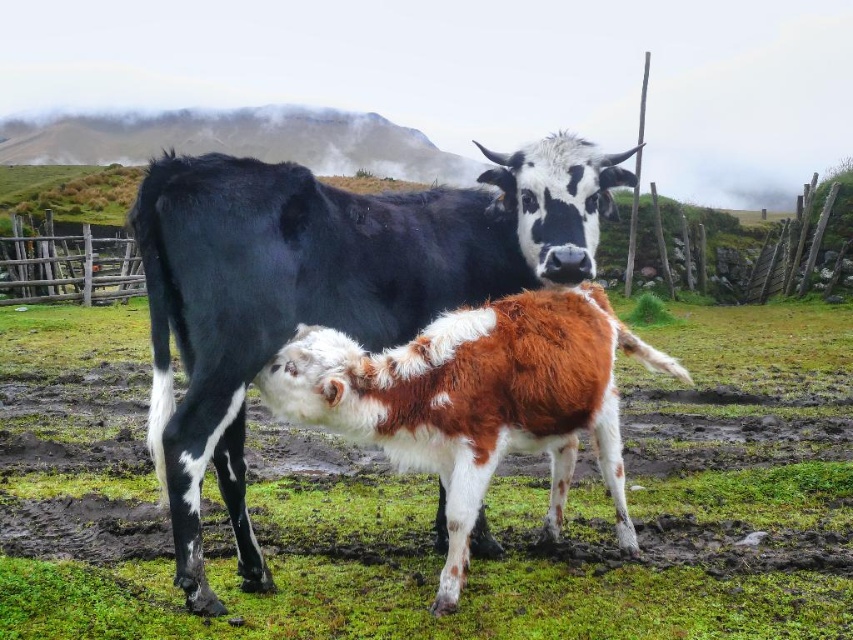
You are a farmer checking the field. You notice the black and white cow at center and the wooden fence at left. Which object is narrower in width?

The black and white cow at center is thinner than the wooden fence at left, so the black and white cow at center is narrower in width.

You are a photographer trying to capture a closeup of the black and white cow at center without the wooden fence at left appearing in the background. Based on their positions, is this possible?

The black and white cow at center is closer to the viewer than the wooden fence at left, so it can be focused on while the fence is blurred in the background, making it possible to take a closeup without the fence appearing clearly.